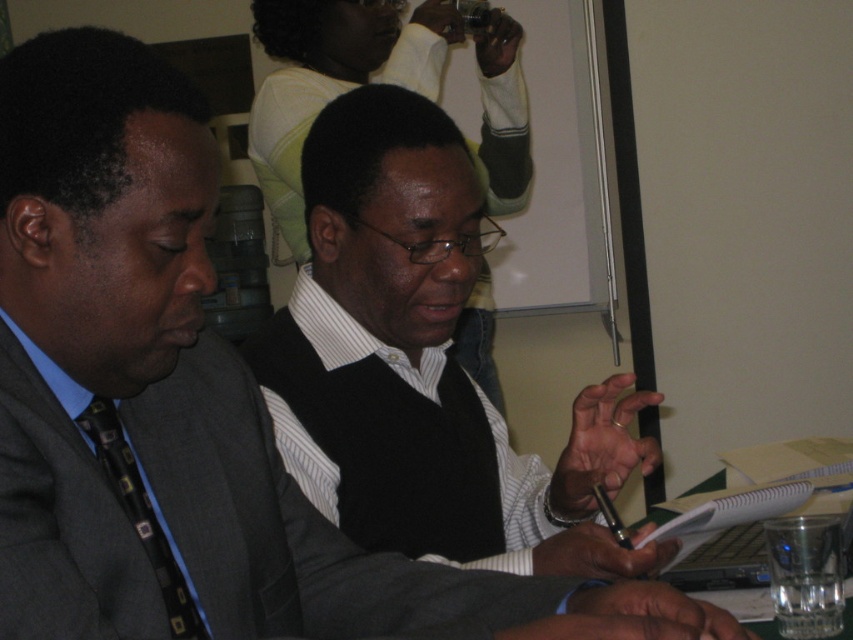
Does black matte vest at center have a larger size compared to black printed tie at left?

Indeed, black matte vest at center has a larger size compared to black printed tie at left.

Between black matte vest at center and black printed tie at left, which one has more height?

With more height is black matte vest at center.

Is point (376, 340) less distant than point (206, 632)?

No, (376, 340) is further to viewer.

This screenshot has height=640, width=853. What are the coordinates of `black matte vest at center` in the screenshot? It's located at (422, 365).

Is point (155, 595) behind point (126, 509)?

No, (155, 595) is in front of (126, 509).

Locate an element on the screen. This screenshot has height=640, width=853. dark gray suit at left is located at coordinates (289, 528).

Locate an element on the screen. dark gray suit at left is located at coordinates (289, 528).

Is black matte vest at center smaller than dark gray suit at left?

Actually, black matte vest at center might be larger than dark gray suit at left.

At what (x,y) coordinates should I click in order to perform the action: click on black matte vest at center. Please return your answer as a coordinate pair (x, y). Looking at the image, I should click on (422, 365).